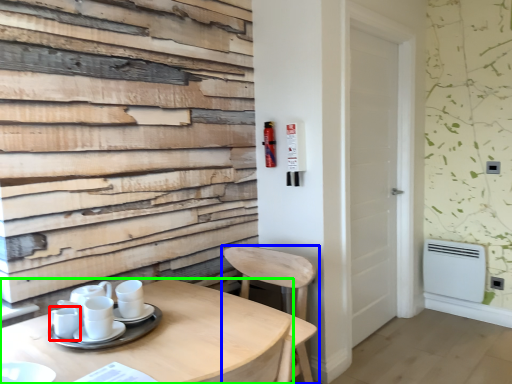
Question: Which object is the farthest from tableware (highlighted by a red box)? Choose among these: chair (highlighted by a blue box) or table (highlighted by a green box).

Choices:
 (A) chair
 (B) table

Answer: (A)